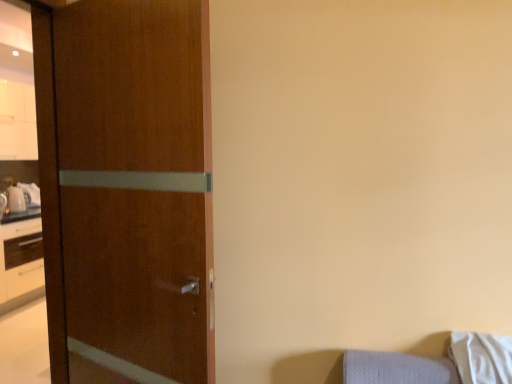
Question: From the image's perspective, is white soft pillow at lower right positioned above or below wooden door at left?

Choices:
 (A) above
 (B) below

Answer: (B)

Question: Considering their positions, is white soft pillow at lower right located in front of or behind wooden door at left?

Choices:
 (A) behind
 (B) front

Answer: (A)

Question: Is white soft pillow at lower right situated inside wooden door at left or outside?

Choices:
 (A) outside
 (B) inside

Answer: (A)

Question: In terms of height, does wooden door at left look taller or shorter compared to white soft pillow at lower right?

Choices:
 (A) tall
 (B) short

Answer: (A)

Question: From a real-world perspective, relative to white soft pillow at lower right, is wooden door at left vertically above or below?

Choices:
 (A) below
 (B) above

Answer: (B)

Question: In the image, is wooden door at left positioned in front of or behind white soft pillow at lower right?

Choices:
 (A) behind
 (B) front

Answer: (B)

Question: Considering the positions of point (172, 34) and point (462, 360), is point (172, 34) closer or farther from the camera than point (462, 360)?

Choices:
 (A) farther
 (B) closer

Answer: (B)